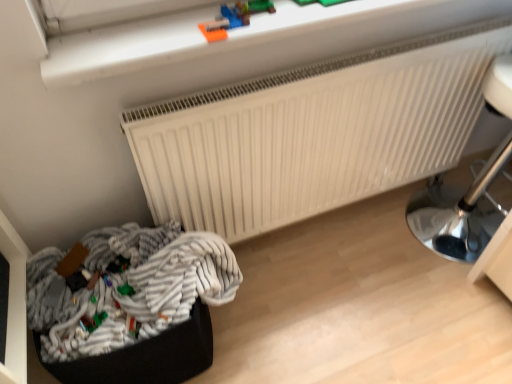
Where is `free spot to the right of striped fabric laundry at lower left`? This screenshot has width=512, height=384. free spot to the right of striped fabric laundry at lower left is located at coordinates (279, 319).